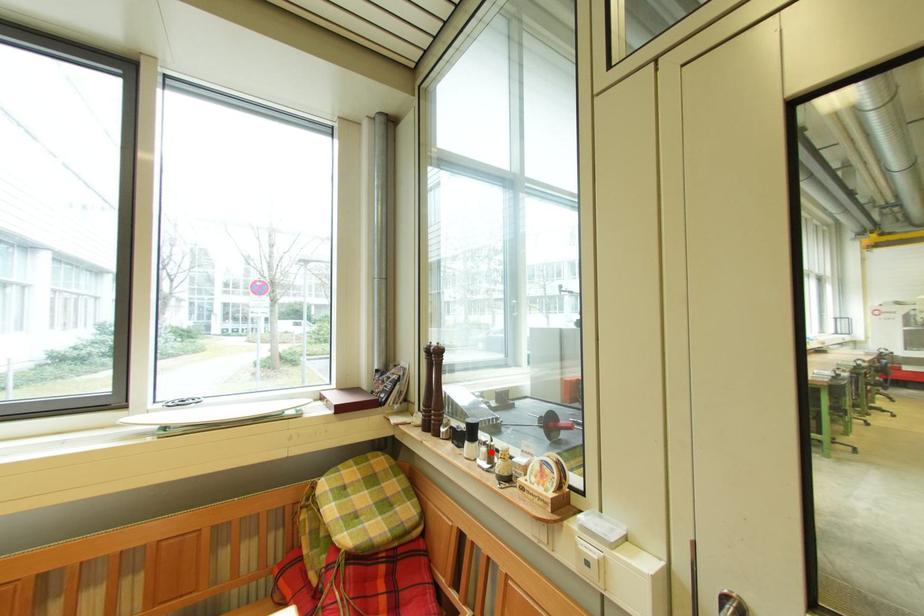
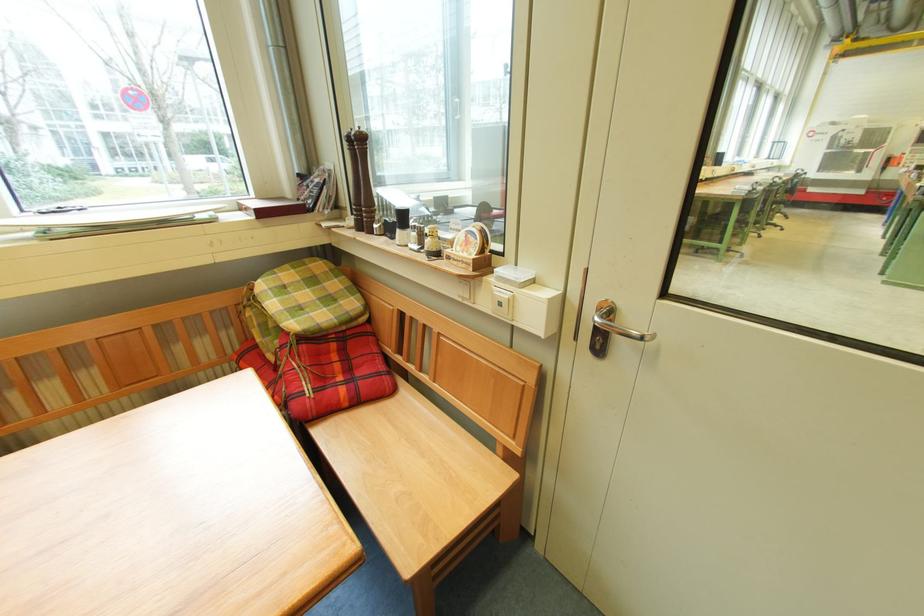
Locate, in the second image, the point that corresponds to the highlighted location in the first image.

(421, 236)